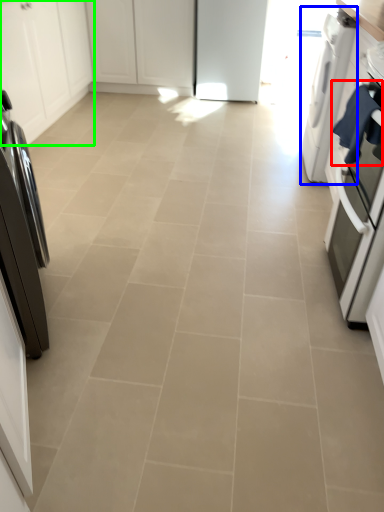
Question: Estimate the real-world distances between objects in this image. Which object is farther from laundry (highlighted by a red box), home appliance (highlighted by a blue box) or cabinetry (highlighted by a green box)?

Choices:
 (A) home appliance
 (B) cabinetry

Answer: (B)